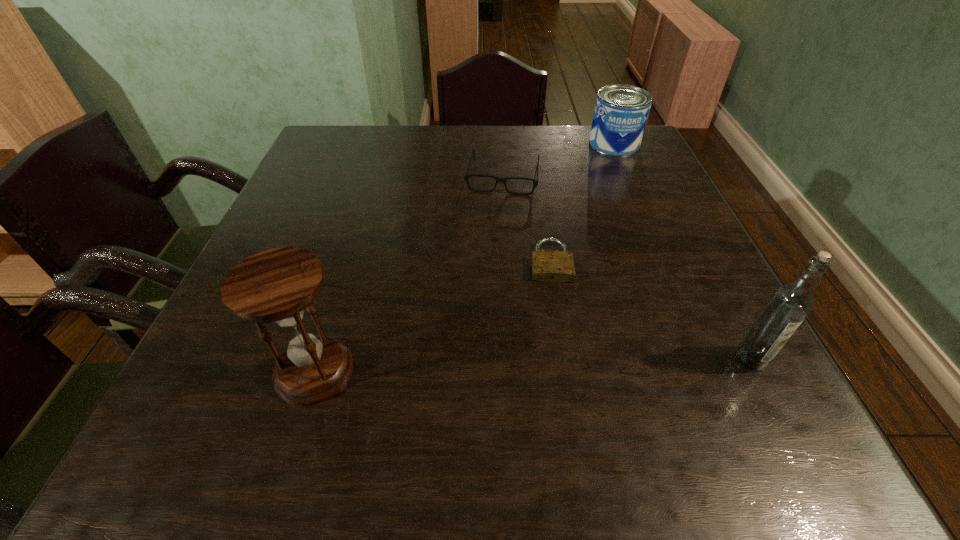
What are the coordinates of `hourglass that is at the near edge` in the screenshot? It's located at (276, 285).

This screenshot has height=540, width=960. What are the coordinates of `vodka that is at the near edge` in the screenshot? It's located at (788, 306).

The height and width of the screenshot is (540, 960). In order to click on object that is at the left edge in this screenshot , I will do `click(276, 285)`.

Where is `vodka that is at the right edge`? Image resolution: width=960 pixels, height=540 pixels. vodka that is at the right edge is located at coordinates (788, 306).

Find the location of a particular element. Image resolution: width=960 pixels, height=540 pixels. can that is at the right edge is located at coordinates (621, 111).

Locate an element on the screen. This screenshot has width=960, height=540. object that is at the near left corner is located at coordinates (276, 285).

Where is `object at the far right corner`? object at the far right corner is located at coordinates (621, 111).

Image resolution: width=960 pixels, height=540 pixels. I want to click on object that is at the near right corner, so click(788, 306).

In the image, there is a desktop. Where is `vacant area at the far edge`? Image resolution: width=960 pixels, height=540 pixels. vacant area at the far edge is located at coordinates (433, 154).

Identify the location of free location at the near edge. The height and width of the screenshot is (540, 960). (589, 367).